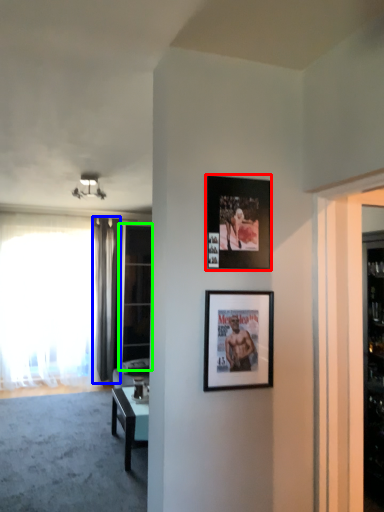
Question: Considering the real-world distances, which object is closest to picture frame (highlighted by a red box)? curtain (highlighted by a blue box) or glass door (highlighted by a green box).

Choices:
 (A) curtain
 (B) glass door

Answer: (B)